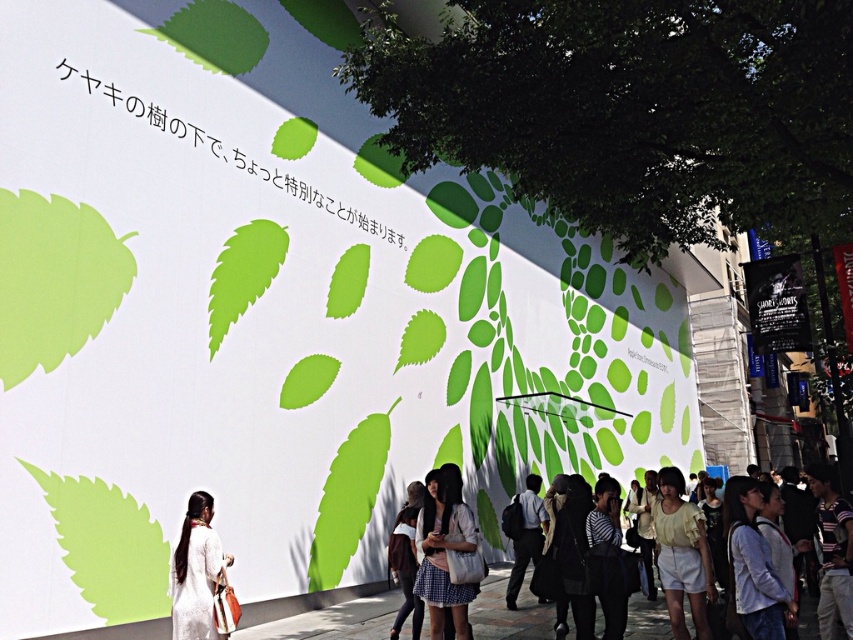
You are a delivery person carrying a large package that is 1.5 meters long. You need to walk through the area shown in the image. Can you pass between the concrete pavement at lower center and the dark gray wool coat at center without the package hitting either?

The concrete pavement at lower center is smaller than the dark gray wool coat at center, so the space between them may be narrow. Since the package is 1.5 meters long, it might not fit through the gap. You should choose a different path to avoid potential collisions.